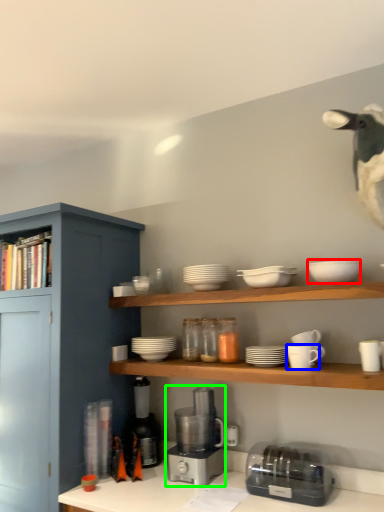
Question: Which object is positioned closest to tableware (highlighted by a red box)? Select from tableware (highlighted by a blue box) and coffee machine (highlighted by a green box).

Choices:
 (A) tableware
 (B) coffee machine

Answer: (A)